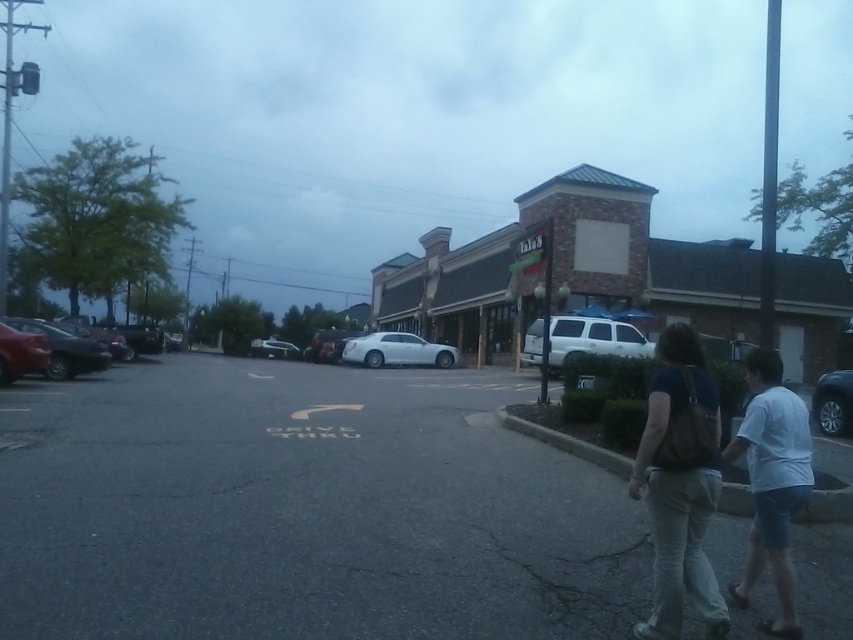
You are a delivery person who needs to park your car in the parking lot behind the building. You see a white glossy sedan at center and a satin black car at right. Which car is closer to the parking lot entrance?

The white glossy sedan at center is closer to the parking lot entrance because it is positioned to the left of the satin black car at right, and the parking lot entrance is likely on the left side of the drive thru area.

Consider the image. You are a customer waiting in the drive thru lane. You see a white glossy sedan at center and a satin black car at right. Which car is blocking your path?

The satin black car at right is behind the white glossy sedan at center, so the white glossy sedan at center is blocking your path.